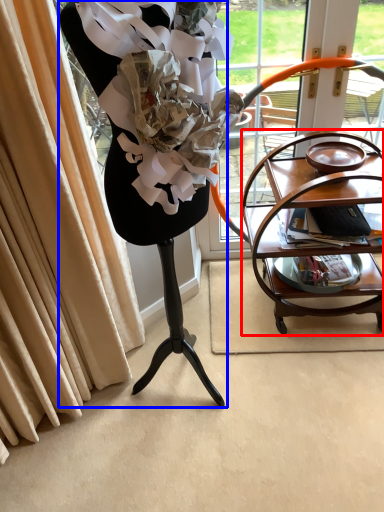
Question: Which point is further to the camera, table (highlighted by a red box) or furniture (highlighted by a blue box)?

Choices:
 (A) table
 (B) furniture

Answer: (A)